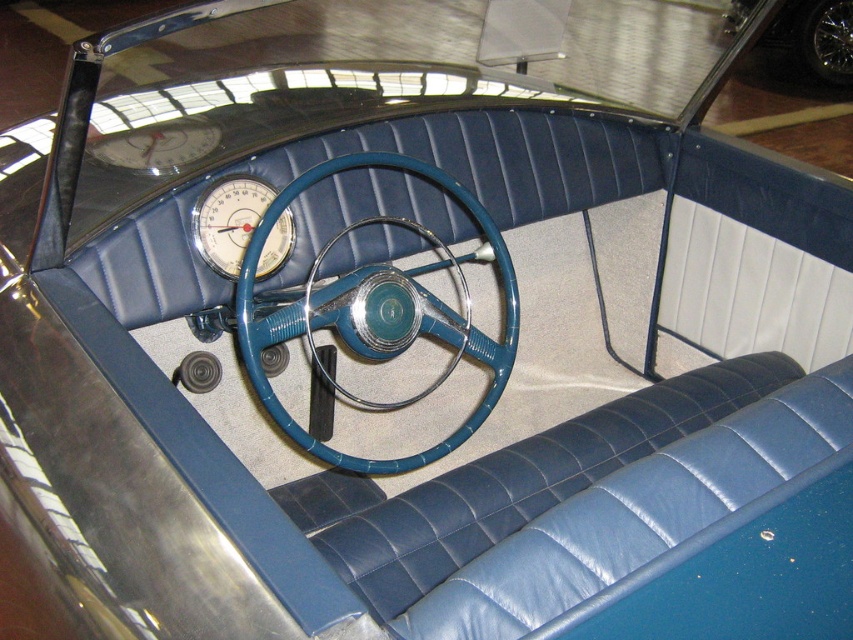
Question: Where is blue textured steering wheel at center located in relation to blue metallic steering wheel at center in the image?

Choices:
 (A) right
 (B) left

Answer: (B)

Question: Estimate the real-world distances between objects in this image. Which object is closer to the metallic silver wheel at center?

Choices:
 (A) shiny chrome wheel at upper right
 (B) metallic silver gauge at center
 (C) blue metallic steering wheel at center
 (D) blue textured steering wheel at center

Answer: (A)

Question: Is blue textured steering wheel at center positioned in front of shiny chrome wheel at upper right?

Choices:
 (A) yes
 (B) no

Answer: (A)

Question: Can you confirm if shiny chrome wheel at upper right is positioned above blue metallic steering wheel at center?

Choices:
 (A) no
 (B) yes

Answer: (B)

Question: Which point is closer to the camera taking this photo?

Choices:
 (A) (238, 204)
 (B) (824, 8)
 (C) (415, 227)

Answer: (C)

Question: Among these objects, which one is nearest to the camera?

Choices:
 (A) metallic silver wheel at center
 (B) blue metallic steering wheel at center
 (C) shiny chrome wheel at upper right
 (D) blue textured steering wheel at center

Answer: (D)